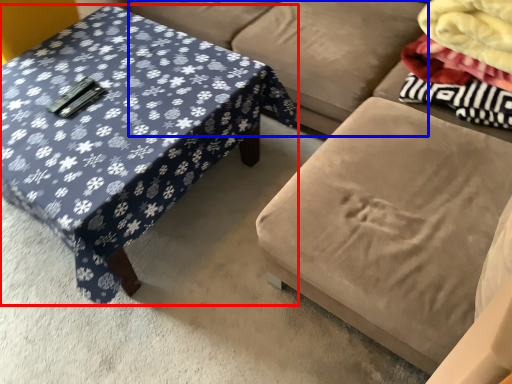
Question: Among these objects, which one is nearest to the camera, coffee table (highlighted by a red box) or couch (highlighted by a blue box)?

Choices:
 (A) coffee table
 (B) couch

Answer: (A)